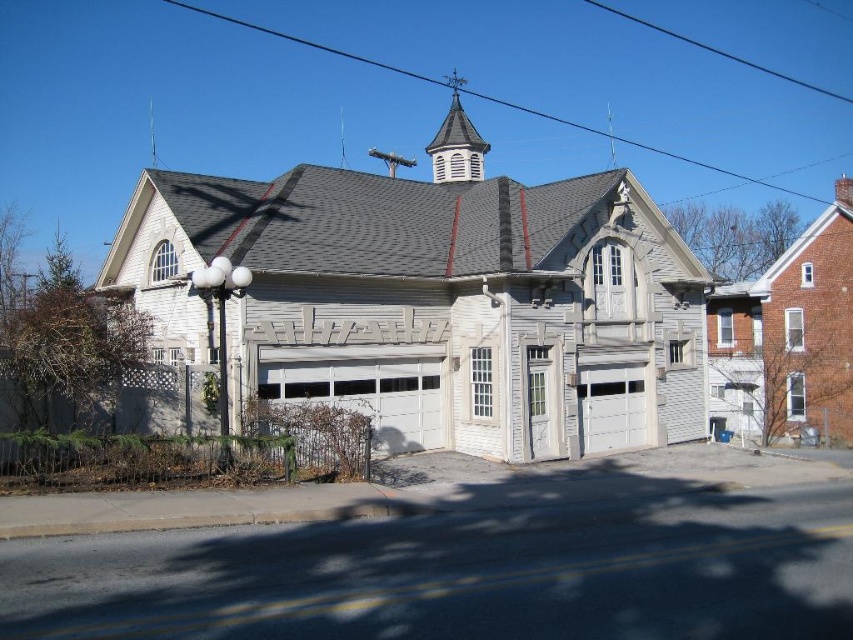
Question: Is white painted wood garage door at center in front of white wood shingles at upper center?

Choices:
 (A) no
 (B) yes

Answer: (B)

Question: Observing the image, what is the correct spatial positioning of white painted wood garage door at center in reference to white smooth garage door at center?

Choices:
 (A) above
 (B) below

Answer: (A)

Question: Considering the real-world distances, which object is closest to the white wood shingles at upper center?

Choices:
 (A) white smooth garage door at center
 (B) white wood church at center
 (C) white painted wood garage door at center

Answer: (B)

Question: Which of these objects is positioned farthest from the white smooth garage door at center?

Choices:
 (A) white painted wood garage door at center
 (B) white wood shingles at upper center

Answer: (B)

Question: Observing the image, what is the correct spatial positioning of white wood church at center in reference to white wood shingles at upper center?

Choices:
 (A) right
 (B) left

Answer: (B)

Question: Which point is farther to the camera?

Choices:
 (A) (381, 308)
 (B) (610, 445)
 (C) (395, 396)
 (D) (447, 180)

Answer: (D)